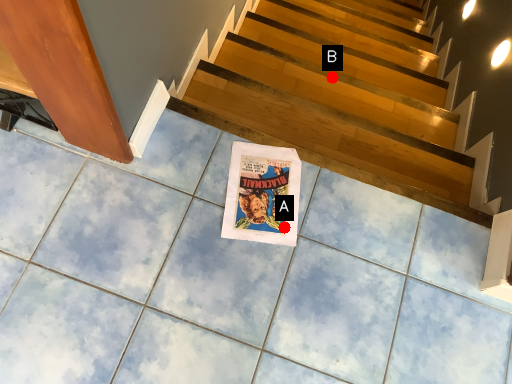
Question: Two points are circled on the image, labeled by A and B beside each circle. Which point is further to the camera?

Choices:
 (A) A is further
 (B) B is further

Answer: (B)